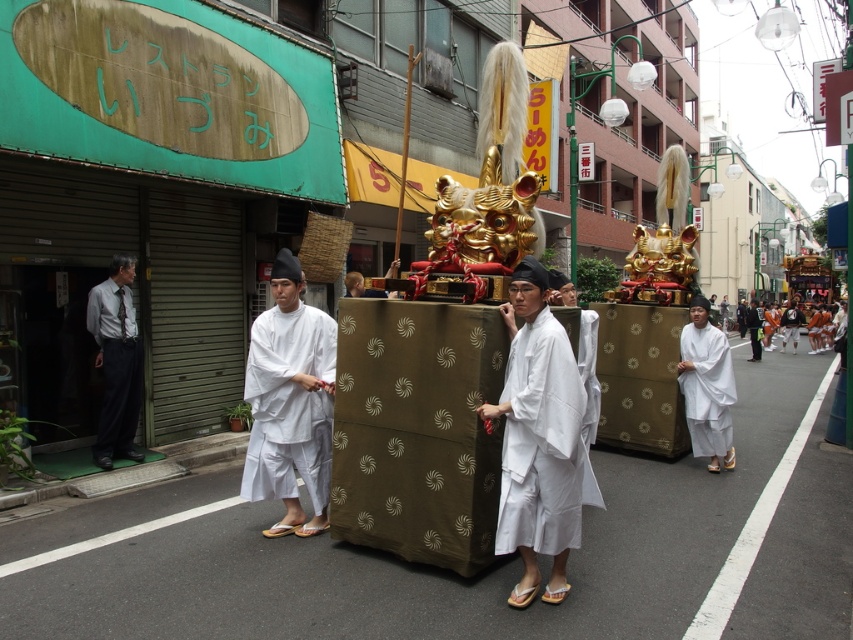
Where is `white cotton robe at center`? The width and height of the screenshot is (853, 640). white cotton robe at center is located at coordinates (289, 404).

Who is lower down, white cotton robe at center or white matte robe at right?

white matte robe at right is lower down.

Image resolution: width=853 pixels, height=640 pixels. I want to click on white cotton robe at center, so click(x=289, y=404).

Is gray shirt and tie at left bigger than orange cotton t-shirt at center?

No.

Which is behind, point (106, 422) or point (831, 330)?

The point (831, 330) is more distant.

You are a GUI agent. You are given a task and a screenshot of the screen. Output one action in this format:
    pyautogui.click(x=<x>, y=<y>)
    Task: Click on the gray shirt and tie at left
    The width and height of the screenshot is (853, 640).
    Given the screenshot: What is the action you would take?
    pyautogui.click(x=115, y=362)

Which is behind, point (569, 353) or point (689, 406)?

The point (689, 406) is behind.

What do you see at coordinates (541, 442) in the screenshot?
I see `white silk robe at center` at bounding box center [541, 442].

Describe the element at coordinates (541, 442) in the screenshot. I see `white silk robe at center` at that location.

At what (x,y) coordinates should I click in order to perform the action: click on white silk robe at center. Please return your answer as a coordinate pair (x, y). Looking at the image, I should click on (541, 442).